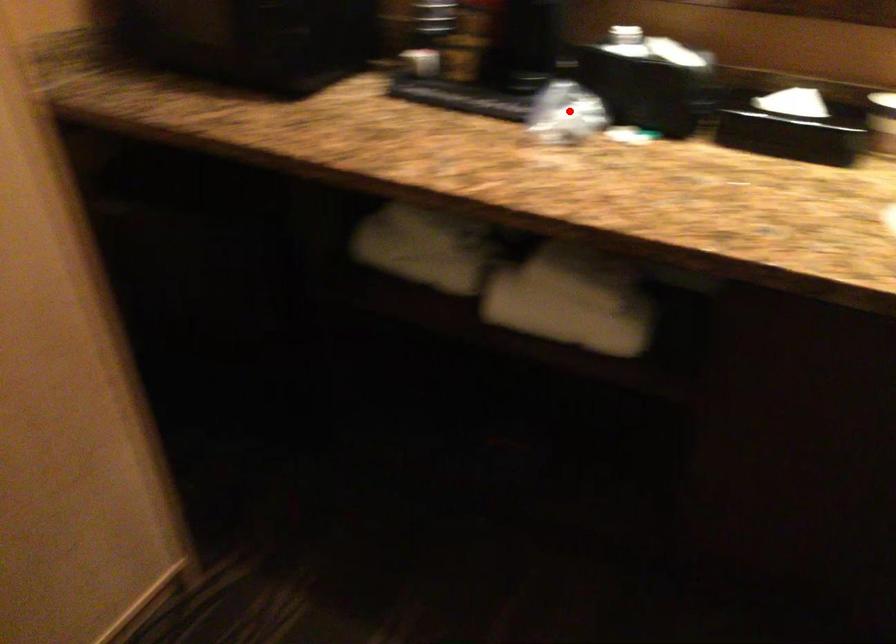
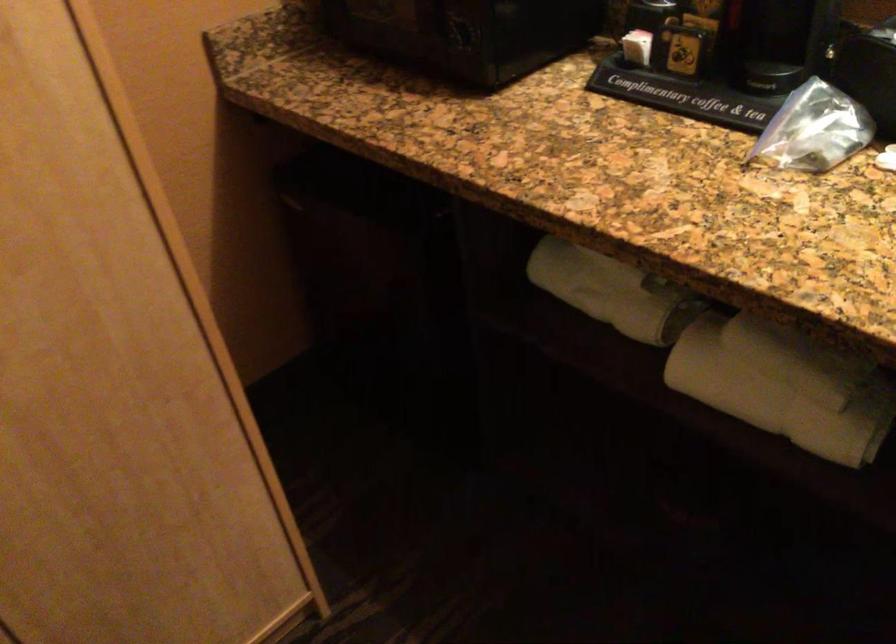
Where in the second image is the point corresponding to the highlighted location from the first image?

(814, 129)